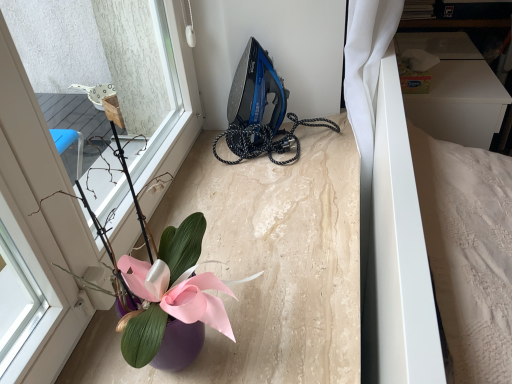
Measure the distance between white matte bed at right and camera.

The depth of white matte bed at right is 45.92 centimeters.

Where is `purple glossy vase at lower left`? Image resolution: width=512 pixels, height=384 pixels. purple glossy vase at lower left is located at coordinates [178, 345].

Looking at the image, does purple glossy vase at lower left seem bigger or smaller compared to blue glossy iron at upper center?

Clearly, purple glossy vase at lower left is larger in size than blue glossy iron at upper center.

Locate an element on the screen. The width and height of the screenshot is (512, 384). houseplant in front of the blue glossy iron at upper center is located at coordinates (178, 345).

Which object is further away from the camera, purple glossy vase at lower left or blue glossy iron at upper center?

blue glossy iron at upper center is further from the camera.

Is point (195, 348) positioned before point (258, 115)?

That is True.

From the picture: From the image's perspective, is blue glossy iron at upper center below white matte bed at right?

Actually, blue glossy iron at upper center appears above white matte bed at right in the image.

Is blue glossy iron at upper center turned away from white matte bed at right?

No, white matte bed at right is not at the back of blue glossy iron at upper center.

Is blue glossy iron at upper center further to the viewer compared to white matte bed at right?

No, blue glossy iron at upper center is closer to the camera.

Find the location of `bed behind the blue glossy iron at upper center`. bed behind the blue glossy iron at upper center is located at coordinates (397, 255).

In order to click on houseplant below the blue glossy iron at upper center (from the image's perspective) in this screenshot , I will do `click(178, 345)`.

Is blue glossy iron at upper center to the left or to the right of purple glossy vase at lower left in the image?

Based on their positions, blue glossy iron at upper center is located to the right of purple glossy vase at lower left.

From the image's perspective, does blue glossy iron at upper center appear higher than purple glossy vase at lower left?

Yes, from the image's perspective, blue glossy iron at upper center is on top of purple glossy vase at lower left.

Considering the sizes of blue glossy iron at upper center and purple glossy vase at lower left in the image, is blue glossy iron at upper center wider or thinner than purple glossy vase at lower left?

In the image, blue glossy iron at upper center appears to be wider than purple glossy vase at lower left.

Is white matte bed at right oriented away from blue glossy iron at upper center?

No, white matte bed at right's orientation is not away from blue glossy iron at upper center.

Considering the sizes of objects white matte bed at right and blue glossy iron at upper center in the image provided, who is wider, white matte bed at right or blue glossy iron at upper center?

white matte bed at right.

Who is taller, white matte bed at right or blue glossy iron at upper center?

white matte bed at right.

From a real-world perspective, which object stands above the other?

blue glossy iron at upper center is physically above.

How distant is white matte bed at right from purple glossy vase at lower left?

The distance of white matte bed at right from purple glossy vase at lower left is 15.11 inches.

From the image's perspective, relative to purple glossy vase at lower left, is white matte bed at right above or below?

white matte bed at right is above purple glossy vase at lower left.

From a real-world perspective, relative to purple glossy vase at lower left, is white matte bed at right vertically above or below?

From a real-world perspective, white matte bed at right is physically below purple glossy vase at lower left.

From a real-world perspective, is purple glossy vase at lower left located higher than white matte bed at right?

Yes, from a real-world perspective, purple glossy vase at lower left is above white matte bed at right.

Is point (173, 230) in front of point (378, 119)?

Yes.

Can you tell me how much purple glossy vase at lower left and white matte bed at right differ in facing direction?

purple glossy vase at lower left and white matte bed at right are facing 0.167 degrees away from each other.

I want to click on equipment on the right of purple glossy vase at lower left, so click(x=260, y=111).

In order to click on equipment that appears in front of the white matte bed at right in this screenshot , I will do `click(260, 111)`.

From the image, which object appears to be nearer to white matte bed at right, purple glossy vase at lower left or blue glossy iron at upper center?

purple glossy vase at lower left lies closer to white matte bed at right than the other object.

Which object lies nearer to the anchor point purple glossy vase at lower left, blue glossy iron at upper center or white matte bed at right?

white matte bed at right.

Estimate the real-world distances between objects in this image. Which object is further from blue glossy iron at upper center, purple glossy vase at lower left or white matte bed at right?

Among the two, purple glossy vase at lower left is located further to blue glossy iron at upper center.

In the scene shown: When comparing their distances from purple glossy vase at lower left, does white matte bed at right or blue glossy iron at upper center seem further?

blue glossy iron at upper center is further to purple glossy vase at lower left.

Considering their positions, is white matte bed at right positioned closer to blue glossy iron at upper center than purple glossy vase at lower left?

Among the two, white matte bed at right is located nearer to blue glossy iron at upper center.

Looking at the image, which one is located further to white matte bed at right, blue glossy iron at upper center or purple glossy vase at lower left?

blue glossy iron at upper center is further to white matte bed at right.

Locate an element on the screen. equipment between purple glossy vase at lower left and white matte bed at right in the front-back direction is located at coordinates click(260, 111).